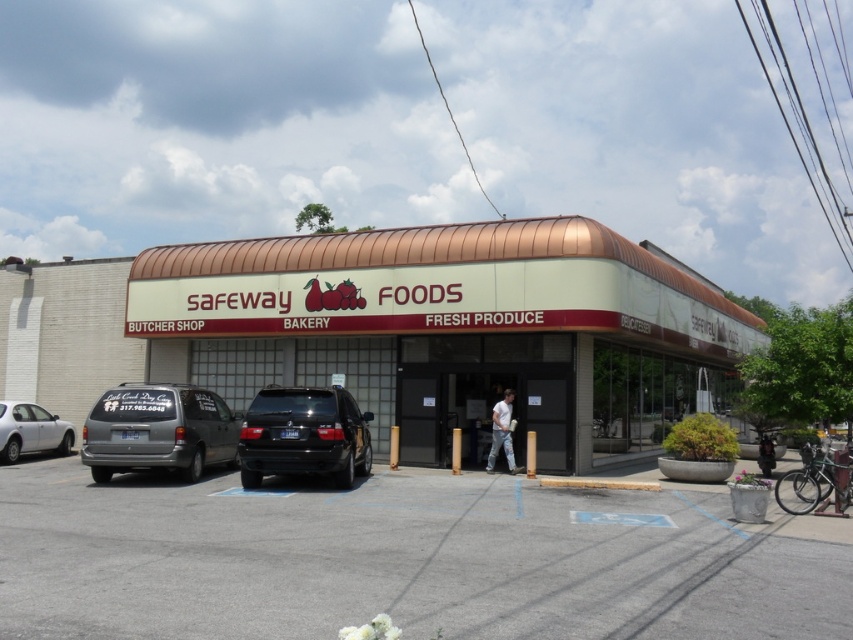
You are a delivery driver who needs to park your 6.5 feet tall truck in the Safeway Foods store parking lot. Looking at the parking lot, can you determine if there is enough vertical space between the silver metallic van at left and black matte suv at center to park your truck?

The silver metallic van at left is much taller than the black matte suv at center, so there is enough vertical space between them for your 6.5 feet tall truck to park.

You are a customer arriving at the Safeway Foods store and need to park your car. You see a silver metallic van at left and a black matte suv at center. Which vehicle is closer to the entrance of the store?

The black matte suv at center is closer to the entrance of the store because it is positioned below the silver metallic van at left, which is further away.

You are standing at the entrance of the Safeway Foods store and want to find a parking spot. The entrance is at the bottom of the image. Which direction should you walk to reach the parking spot marked by the point at coordinates [405,560]?

The point at coordinates [405,560] is located on the gray asphalt parking lot at center. Since the entrance is at the bottom of the image, you should walk towards the center of the parking lot to reach the parking spot marked by the point at coordinates [405,560].